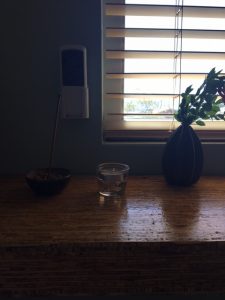
Locate an element on the screen. Image resolution: width=225 pixels, height=300 pixels. blue wall is located at coordinates (54, 25).